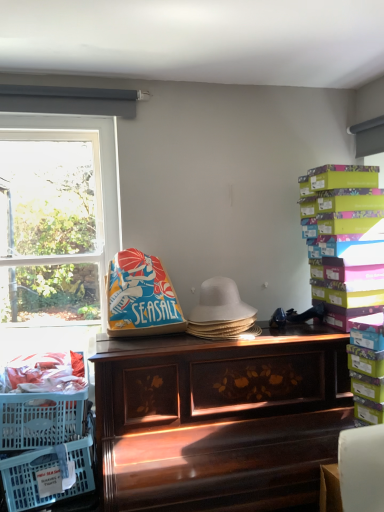
Question: Is translucent plastic crate at lower left at the left side of white woven hat at center?

Choices:
 (A) no
 (B) yes

Answer: (B)

Question: Is translucent plastic crate at lower left facing away from white woven hat at center?

Choices:
 (A) yes
 (B) no

Answer: (B)

Question: Can you confirm if translucent plastic crate at lower left is shorter than white woven hat at center?

Choices:
 (A) yes
 (B) no

Answer: (B)

Question: Is translucent plastic crate at lower left in front of white woven hat at center?

Choices:
 (A) no
 (B) yes

Answer: (B)

Question: Is translucent plastic crate at lower left positioned beyond the bounds of white woven hat at center?

Choices:
 (A) yes
 (B) no

Answer: (A)

Question: Is point (238, 297) positioned closer to the camera than point (278, 484)?

Choices:
 (A) farther
 (B) closer

Answer: (A)

Question: In terms of width, does white woven hat at center look wider or thinner when compared to wooden piano at center?

Choices:
 (A) thin
 (B) wide

Answer: (A)

Question: Is white woven hat at center spatially inside wooden piano at center, or outside of it?

Choices:
 (A) inside
 (B) outside

Answer: (B)

Question: From a real-world perspective, relative to wooden piano at center, is white woven hat at center vertically above or below?

Choices:
 (A) below
 (B) above

Answer: (B)

Question: In terms of height, does wooden piano at center look taller or shorter compared to white woven hat at center?

Choices:
 (A) tall
 (B) short

Answer: (A)

Question: In the image, is wooden piano at center positioned in front of or behind white woven hat at center?

Choices:
 (A) front
 (B) behind

Answer: (A)

Question: Is wooden piano at center wider or thinner than white woven hat at center?

Choices:
 (A) thin
 (B) wide

Answer: (B)

Question: Do you think wooden piano at center is within white woven hat at center, or outside of it?

Choices:
 (A) inside
 (B) outside

Answer: (B)

Question: Is wooden piano at center wider or thinner than multicolored cardboard boxes at right?

Choices:
 (A) wide
 (B) thin

Answer: (A)

Question: Is wooden piano at center in front of or behind multicolored cardboard boxes at right in the image?

Choices:
 (A) behind
 (B) front

Answer: (B)